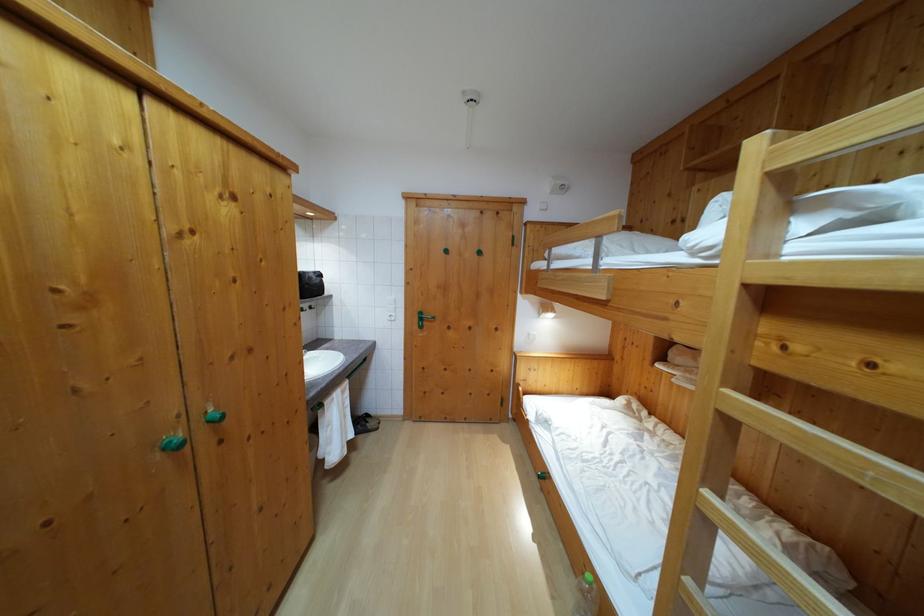
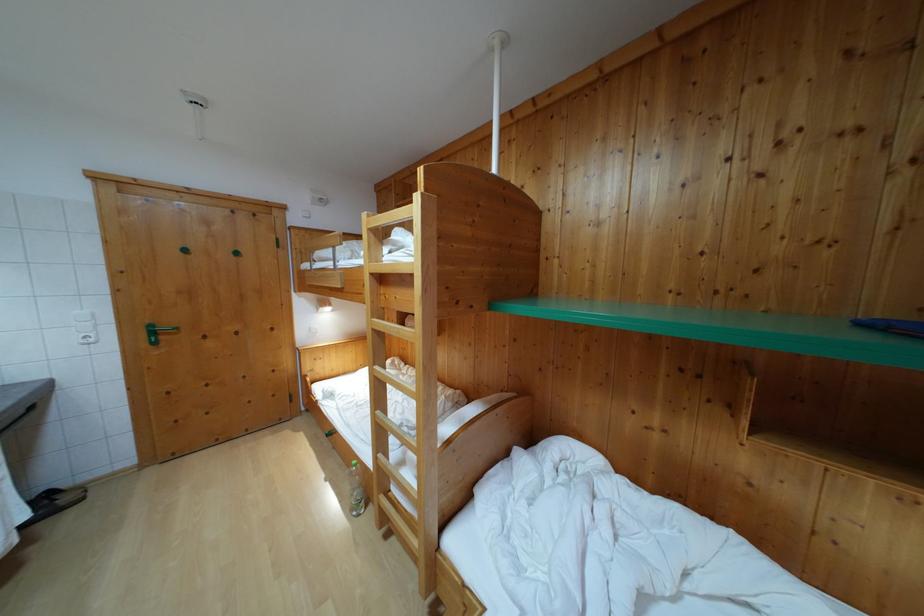
The point at [450,259] is marked in the first image. Where is the corresponding point in the second image?

(189, 257)